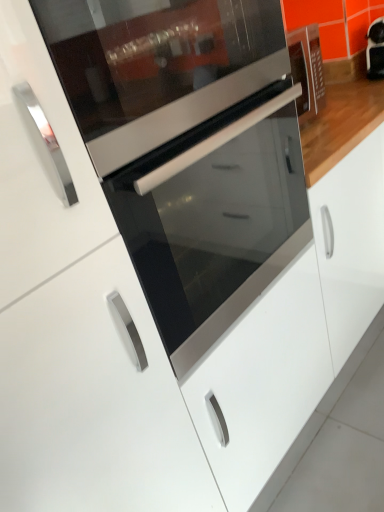
Question: Would you consider glossy white cabinet at center to be distant from satin silver oven at center?

Choices:
 (A) no
 (B) yes

Answer: (A)

Question: From the image's perspective, is glossy white cabinet at center beneath satin silver oven at center?

Choices:
 (A) no
 (B) yes

Answer: (B)

Question: Can you confirm if glossy white cabinet at center is bigger than satin silver oven at center?

Choices:
 (A) yes
 (B) no

Answer: (A)

Question: Is glossy white cabinet at center smaller than satin silver oven at center?

Choices:
 (A) no
 (B) yes

Answer: (A)

Question: From a real-world perspective, is glossy white cabinet at center beneath satin silver oven at center?

Choices:
 (A) yes
 (B) no

Answer: (A)

Question: Is glossy white cabinet at center not within satin silver oven at center?

Choices:
 (A) yes
 (B) no

Answer: (A)

Question: From a real-world perspective, is satin silver oven at center beneath matte black oven at center?

Choices:
 (A) yes
 (B) no

Answer: (B)

Question: Is satin silver oven at center shorter than matte black oven at center?

Choices:
 (A) yes
 (B) no

Answer: (A)

Question: Does satin silver oven at center have a greater height compared to matte black oven at center?

Choices:
 (A) no
 (B) yes

Answer: (A)

Question: Is satin silver oven at center far from matte black oven at center?

Choices:
 (A) yes
 (B) no

Answer: (B)

Question: Is satin silver oven at center in front of matte black oven at center?

Choices:
 (A) no
 (B) yes

Answer: (B)

Question: Does satin silver oven at center lie behind matte black oven at center?

Choices:
 (A) no
 (B) yes

Answer: (A)

Question: Is glossy white cabinet at center taller than matte black oven at center?

Choices:
 (A) yes
 (B) no

Answer: (A)